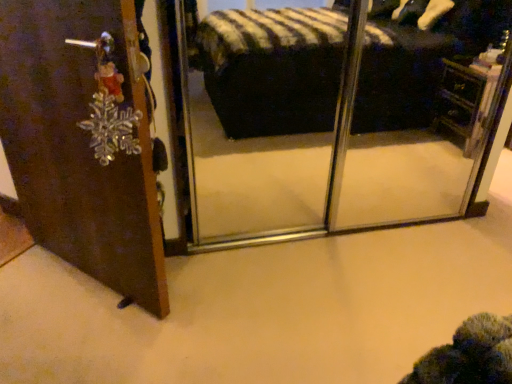
Question: Considering the positions of brown wooden door at left and wooden vanity at right in the image, is brown wooden door at left wider or thinner than wooden vanity at right?

Choices:
 (A) thin
 (B) wide

Answer: (B)

Question: Relative to wooden vanity at right, is brown wooden door at left in front or behind?

Choices:
 (A) front
 (B) behind

Answer: (A)

Question: Based on their sizes in the image, would you say brown wooden door at left is bigger or smaller than wooden vanity at right?

Choices:
 (A) small
 (B) big

Answer: (B)

Question: Looking at the image, does wooden vanity at right seem bigger or smaller compared to brown wooden door at left?

Choices:
 (A) big
 (B) small

Answer: (B)

Question: From a real-world perspective, is wooden vanity at right above or below brown wooden door at left?

Choices:
 (A) above
 (B) below

Answer: (B)

Question: From the image's perspective, is wooden vanity at right positioned above or below brown wooden door at left?

Choices:
 (A) above
 (B) below

Answer: (A)

Question: Which is correct: wooden vanity at right is inside brown wooden door at left, or outside of it?

Choices:
 (A) outside
 (B) inside

Answer: (A)